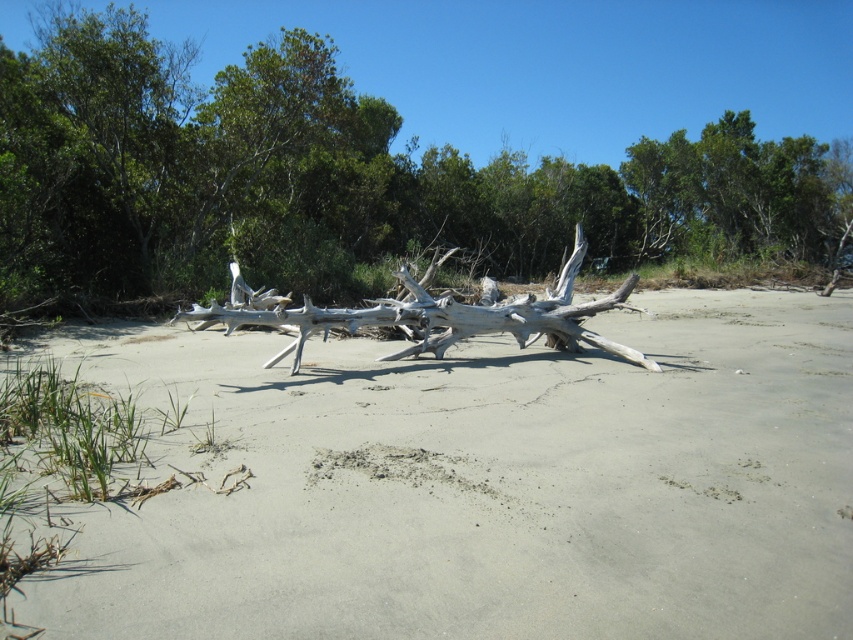
You are standing on the beach and want to place a small seashell between the gray sand at center and the white driftwood at center. Based on their positions, which object should the seashell be closer to?

The gray sand at center is to the left of white driftwood at center, so the seashell should be placed closer to the white driftwood at center to be between them.

You are standing on the beach and looking at the image. There is a point labeled as point (480,483). What is located at that point?

The point (480,483) corresponds to gray sand at center.

You are standing on the beach and want to place a small flag exactly at the gray sand at center. According to the coordinates provided, what are the exact coordinates where you should place the flag?

The gray sand at center should be marked at coordinates point [480,483].